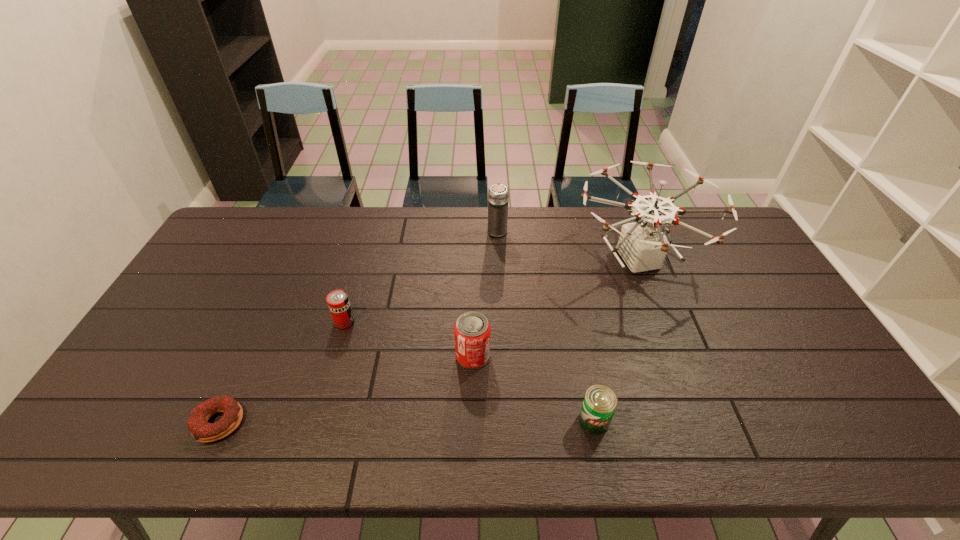
Find the location of a particular element. The height and width of the screenshot is (540, 960). free space that is in between the doughnut and the tallest can is located at coordinates (346, 389).

Where is `empty space that is in between the leftmost can and the thermos bottle`? The image size is (960, 540). empty space that is in between the leftmost can and the thermos bottle is located at coordinates (421, 276).

At what (x,y) coordinates should I click in order to perform the action: click on free space between the tallest object and the rightmost can. Please return your answer as a coordinate pair (x, y). Image resolution: width=960 pixels, height=540 pixels. Looking at the image, I should click on (616, 340).

This screenshot has height=540, width=960. In order to click on vacant area that lies between the second farthest can and the shortest object in this screenshot , I will do `click(346, 389)`.

Where is `free spot between the second can from left to right and the fifth object from right to left`? The width and height of the screenshot is (960, 540). free spot between the second can from left to right and the fifth object from right to left is located at coordinates (409, 339).

Choose which object is the fourth nearest neighbor to the thermos bottle. Please provide its 2D coordinates. Your answer should be formatted as a tuple, i.e. [(x, y)], where the tuple contains the x and y coordinates of a point satisfying the conditions above.

[(600, 402)]

Identify which object is located as the fifth nearest to the drone. Please provide its 2D coordinates. Your answer should be formatted as a tuple, i.e. [(x, y)], where the tuple contains the x and y coordinates of a point satisfying the conditions above.

[(200, 429)]

Identify which can is the nearest to the leftmost object. Please provide its 2D coordinates. Your answer should be formatted as a tuple, i.e. [(x, y)], where the tuple contains the x and y coordinates of a point satisfying the conditions above.

[(338, 302)]

Find the location of a particular element. Image resolution: width=960 pixels, height=540 pixels. can that is the second closest to the rightmost can is located at coordinates (338, 302).